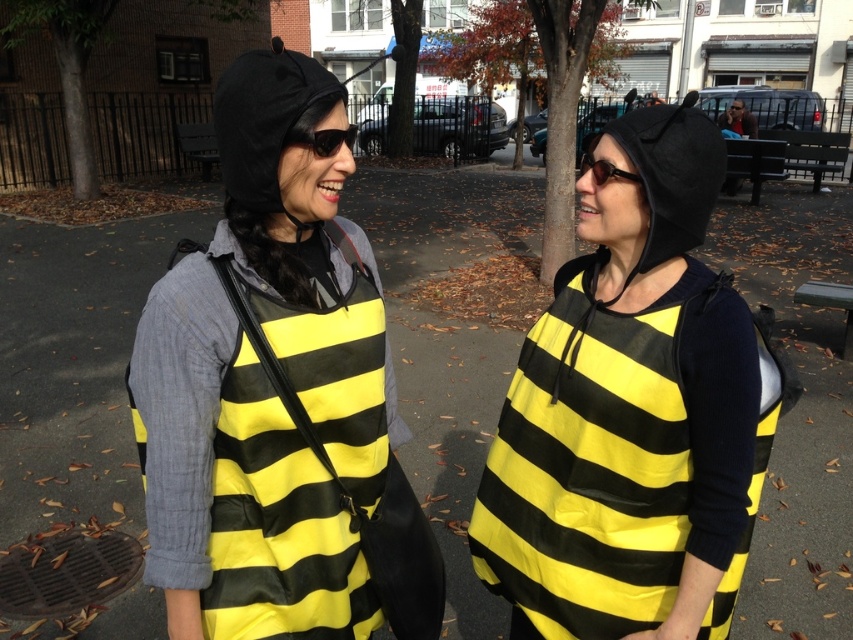
You are a photographer trying to capture a clear photo of the yellow matte fabric bee costume at center and the black plastic sunglasses at center. Which object should you focus on first to ensure it appears sharp in the foreground?

The yellow matte fabric bee costume at center is in front of the black plastic sunglasses at center, so you should focus on the yellow matte fabric bee costume at center first to ensure it appears sharp in the foreground.

Consider the image. You are planning to rent costumes for a Halloween party and need to know which costume is shorter. You see a yellow fabric bee costume at center and a matte black hoodie at center in the image. Which one is shorter?

The yellow fabric bee costume at center is not as tall as matte black hoodie at center, so the yellow fabric bee costume at center is shorter.

What is the spatial relationship between the yellow matte fabric bee costume at center and the black plastic sunglasses at center in terms of width?

The yellow matte fabric bee costume at center is wider than the black plastic sunglasses at center.